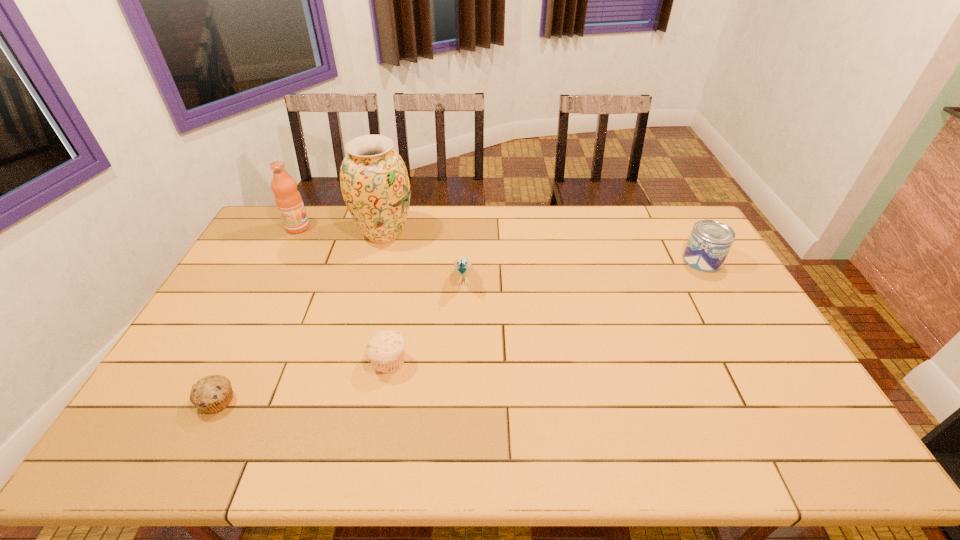
Locate an element on the screen. The width and height of the screenshot is (960, 540). free space located 0.080m on the label side of the fifth shortest object is located at coordinates (x=331, y=228).

Identify the location of free space located at the face of the bird. (458, 406).

At what (x,y) coordinates should I click in order to perform the action: click on vacant point located on the front label of the rightmost object. Please return your answer as a coordinate pair (x, y). This screenshot has height=540, width=960. Looking at the image, I should click on (734, 317).

Identify the location of free region located on the right of the second nearest object. (504, 363).

Where is `vacant space located 0.050m on the back of the shorter muffin`? Image resolution: width=960 pixels, height=540 pixels. vacant space located 0.050m on the back of the shorter muffin is located at coordinates (233, 369).

This screenshot has width=960, height=540. Find the location of `vase at the far edge`. vase at the far edge is located at coordinates (374, 181).

Identify the location of fruit juice that is at the far edge. (289, 202).

You are a GUI agent. You are given a task and a screenshot of the screen. Output one action in this format:
    pyautogui.click(x=<x>, y=<y>)
    Task: Click on the fruit juice at the left edge
    
    Given the screenshot: What is the action you would take?
    pyautogui.click(x=289, y=202)

Identify the location of muffin that is at the left edge. pos(211,394).

The width and height of the screenshot is (960, 540). I want to click on object located at the right edge, so click(x=710, y=241).